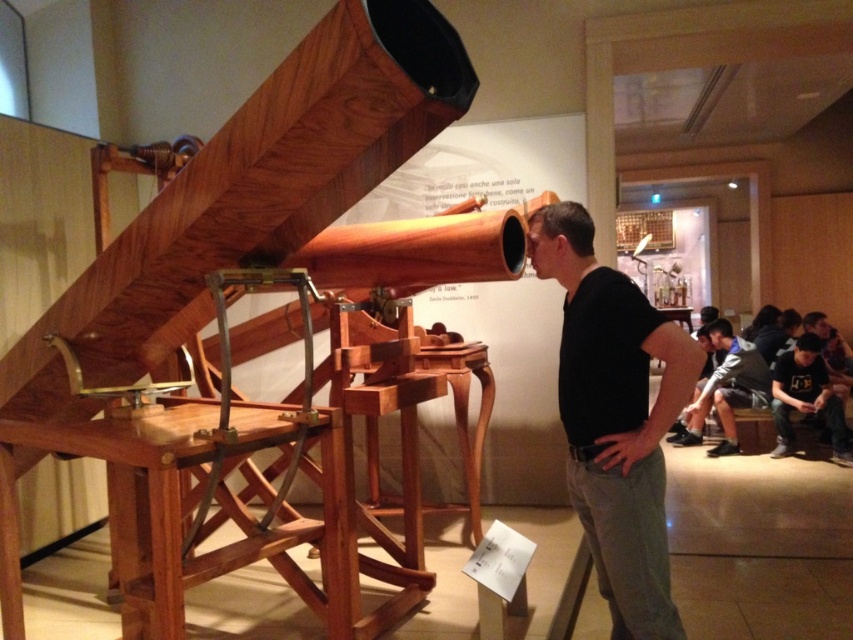
Is point (793, 376) behind point (846, 353)?

No.

Which of these two, dark gray shirt at lower right or dark gray fabric jacket at center, stands taller?

dark gray shirt at lower right

This screenshot has height=640, width=853. Describe the element at coordinates (805, 397) in the screenshot. I see `dark gray shirt at lower right` at that location.

Identify the location of dark gray shirt at lower right. (805, 397).

How much distance is there between gray fabric jacket at lower right and dark gray shirt at lower right?

gray fabric jacket at lower right and dark gray shirt at lower right are 14.97 inches apart from each other.

This screenshot has width=853, height=640. I want to click on gray fabric jacket at lower right, so click(x=727, y=388).

Is black matte shirt at center further to camera compared to dark gray fabric jacket at center?

That is False.

Where is `black matte shirt at center`? The width and height of the screenshot is (853, 640). black matte shirt at center is located at coordinates (614, 417).

At what (x,y) coordinates should I click in order to perform the action: click on black matte shirt at center. Please return your answer as a coordinate pair (x, y). Looking at the image, I should click on (614, 417).